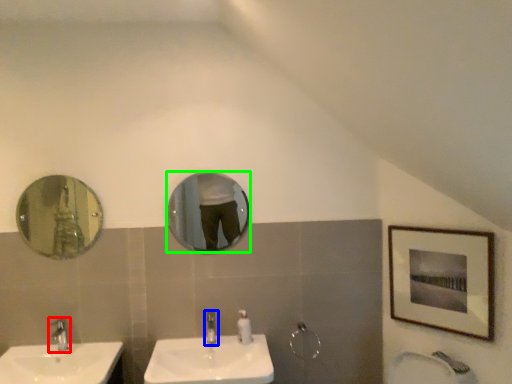
Question: Which object is positioned farthest from tap (highlighted by a red box)? Select from tap (highlighted by a blue box) and mirror (highlighted by a green box).

Choices:
 (A) tap
 (B) mirror

Answer: (B)